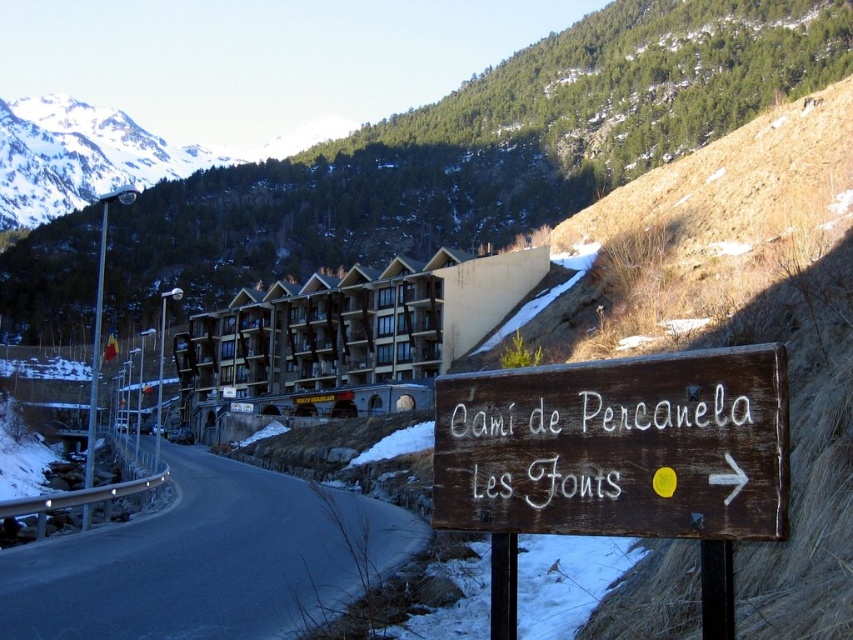
Question: Does brown wooden sign at lower right have a smaller size compared to black asphalt road at lower left?

Choices:
 (A) yes
 (B) no

Answer: (A)

Question: Which object is positioned farthest from the wooden cabin at center?

Choices:
 (A) brown wooden sign at lower right
 (B) black asphalt road at lower left

Answer: (A)

Question: Which point is farther to the camera?

Choices:
 (A) (357, 554)
 (B) (236, 390)

Answer: (B)

Question: Which object is the closest to the wooden cabin at center?

Choices:
 (A) black asphalt road at lower left
 (B) brown wooden sign at lower right

Answer: (A)

Question: Is brown wooden sign at lower right smaller than black asphalt road at lower left?

Choices:
 (A) no
 (B) yes

Answer: (B)

Question: Is brown wooden sign at lower right wider than wooden cabin at center?

Choices:
 (A) no
 (B) yes

Answer: (A)